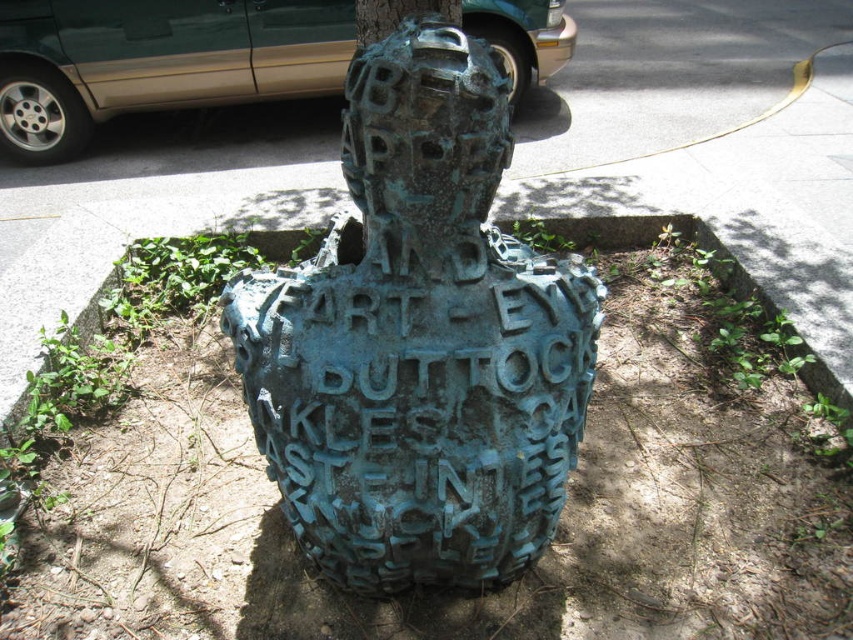
Question: Which object is positioned farthest from the green patina metal sculpture at center?

Choices:
 (A) green matte van at upper left
 (B) green rough bark at upper center

Answer: (A)

Question: Which object appears farthest from the camera in this image?

Choices:
 (A) green rough bark at upper center
 (B) green matte van at upper left
 (C) green patina metal sculpture at center

Answer: (B)

Question: From the image, what is the correct spatial relationship of green patina metal sculpture at center in relation to green matte van at upper left?

Choices:
 (A) above
 (B) below

Answer: (B)

Question: Does green patina metal sculpture at center appear under green matte van at upper left?

Choices:
 (A) yes
 (B) no

Answer: (A)

Question: Can you confirm if green patina metal sculpture at center is positioned above green matte van at upper left?

Choices:
 (A) yes
 (B) no

Answer: (B)

Question: Which point is farther to the camera?

Choices:
 (A) green matte van at upper left
 (B) green rough bark at upper center
 (C) green patina metal sculpture at center

Answer: (A)